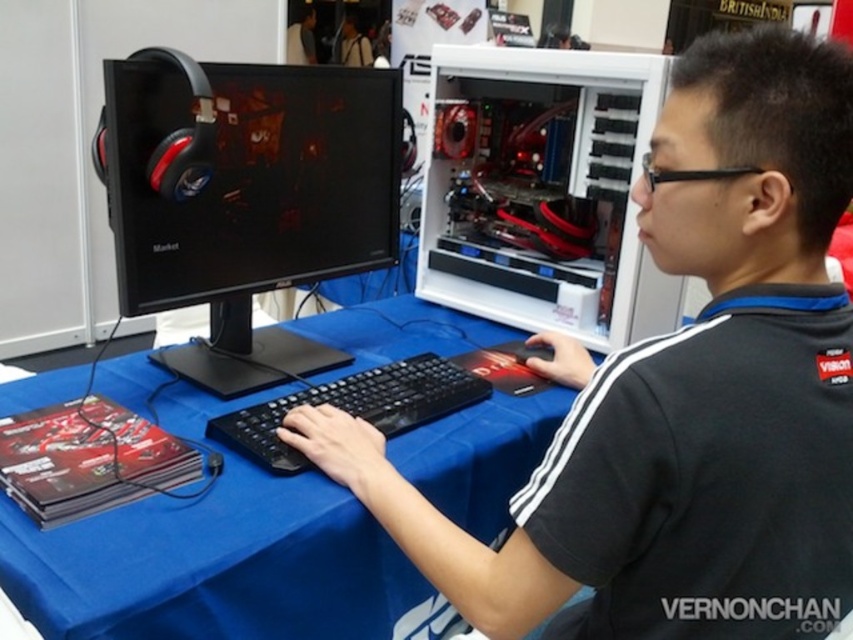
Question: Can you confirm if black matte shirt at center is wider than blue fabric table at center?

Choices:
 (A) no
 (B) yes

Answer: (A)

Question: Which of the following is the closest to the observer?

Choices:
 (A) white plastic computer case at center
 (B) black plastic monitor at left

Answer: (B)

Question: Does blue fabric table at center have a smaller size compared to white plastic computer case at center?

Choices:
 (A) no
 (B) yes

Answer: (A)

Question: Which of these objects is positioned farthest from the black matte shirt at center?

Choices:
 (A) black plastic monitor at left
 (B) black matte keyboard at center
 (C) white plastic computer case at center

Answer: (C)

Question: Observing the image, what is the correct spatial positioning of black matte keyboard at center in reference to black matte mouse at center?

Choices:
 (A) right
 (B) left

Answer: (B)

Question: Among these objects, which one is farthest from the camera?

Choices:
 (A) blue fabric table at center
 (B) black matte mouse at center
 (C) black plastic monitor at left

Answer: (B)